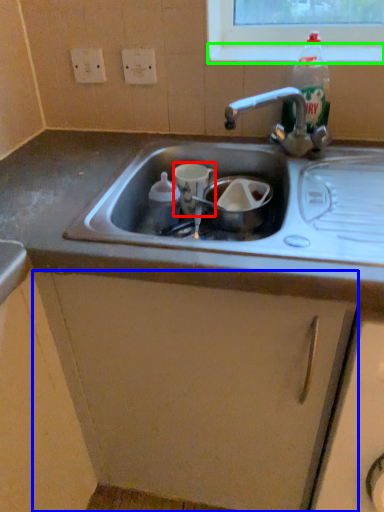
Question: Which is farther away from cup (highlighted by a red box)? cabinetry (highlighted by a blue box) or window sill (highlighted by a green box)?

Choices:
 (A) cabinetry
 (B) window sill

Answer: (A)